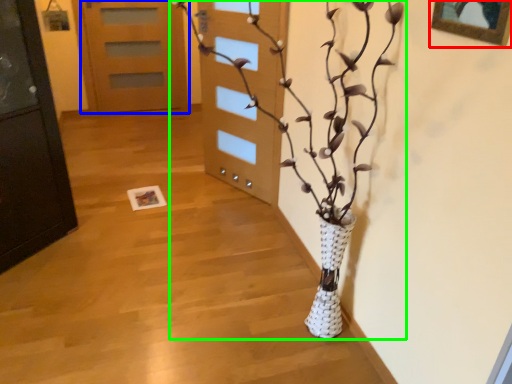
Question: Which is farther away from picture frame (highlighted by a red box)? door (highlighted by a blue box) or houseplant (highlighted by a green box)?

Choices:
 (A) door
 (B) houseplant

Answer: (A)